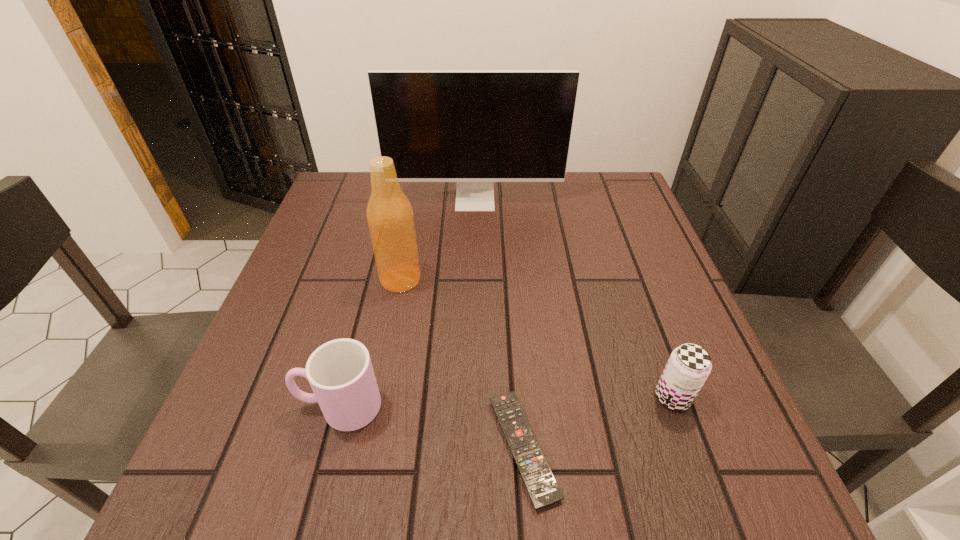
Image resolution: width=960 pixels, height=540 pixels. I want to click on vacant area between the tallest object and the remote control, so click(x=499, y=324).

The height and width of the screenshot is (540, 960). I want to click on vacant region between the farthest object and the rightmost object, so click(x=574, y=299).

Identify the location of unoccupied position between the beer can and the beer bottle. The width and height of the screenshot is (960, 540). (x=537, y=338).

The image size is (960, 540). I want to click on vacant space that is in between the beer bottle and the beer can, so click(x=537, y=338).

Find the location of `vacant space that is in between the farthest object and the cup`. vacant space that is in between the farthest object and the cup is located at coordinates (407, 303).

Image resolution: width=960 pixels, height=540 pixels. In order to click on free space between the remote control and the rightmost object in this screenshot , I will do 598,422.

Find the location of a particular element. The height and width of the screenshot is (540, 960). vacant area that lies between the shortest object and the monitor is located at coordinates (499, 324).

Locate an element on the screen. The width and height of the screenshot is (960, 540). free space between the fourth nearest object and the monitor is located at coordinates (438, 240).

Where is `free space between the cup and the beer bottle`? free space between the cup and the beer bottle is located at coordinates (370, 343).

You are a GUI agent. You are given a task and a screenshot of the screen. Output one action in this format:
    pyautogui.click(x=<x>, y=<y>)
    Task: Click on the object that is the nearest to the second farthest object
    This screenshot has height=540, width=960.
    Given the screenshot: What is the action you would take?
    pyautogui.click(x=474, y=127)